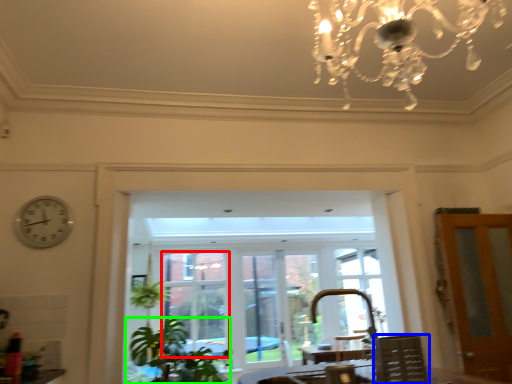
Question: Which object is positioned farthest from window (highlighted by a red box)? Select from chair (highlighted by a blue box) and houseplant (highlighted by a green box).

Choices:
 (A) chair
 (B) houseplant

Answer: (A)